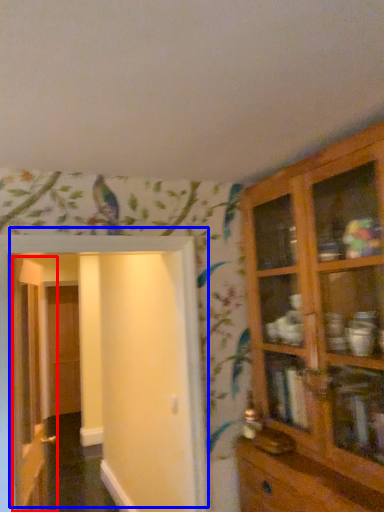
Question: Which of the following is the farthest to the observer, door (highlighted by a red box) or door (highlighted by a blue box)?

Choices:
 (A) door
 (B) door

Answer: (A)